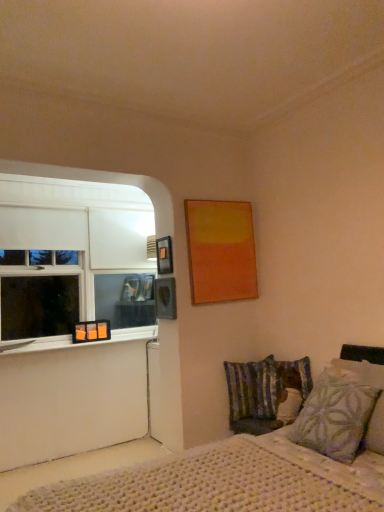
Question: Is patterned fabric pillow at lower right, marked as the first pillow in a right-to-left arrangement, at the back of clear glass window sill at lower left?

Choices:
 (A) no
 (B) yes

Answer: (A)

Question: From the image's perspective, is clear glass window sill at lower left under patterned fabric pillow at lower right, marked as the first pillow in a right-to-left arrangement?

Choices:
 (A) no
 (B) yes

Answer: (B)

Question: Does clear glass window sill at lower left have a greater height compared to patterned fabric pillow at lower right, marked as the first pillow in a right-to-left arrangement?

Choices:
 (A) yes
 (B) no

Answer: (B)

Question: Can we say clear glass window sill at lower left lies outside patterned fabric pillow at lower right, marked as the 2th pillow in a back-to-front arrangement?

Choices:
 (A) yes
 (B) no

Answer: (A)

Question: Can you confirm if clear glass window sill at lower left is bigger than patterned fabric pillow at lower right, the 2th pillow positioned from the left?

Choices:
 (A) no
 (B) yes

Answer: (A)

Question: Is clear glass window sill at lower left oriented towards patterned fabric pillow at lower right, the 2th pillow positioned from the left?

Choices:
 (A) no
 (B) yes

Answer: (A)

Question: Is matte black picture frame at upper left, the second picture frame viewed from the left, shorter than clear glass window sill at lower left?

Choices:
 (A) yes
 (B) no

Answer: (B)

Question: From the image's perspective, is matte black picture frame at upper left, the second picture frame positioned from the right, over clear glass window sill at lower left?

Choices:
 (A) no
 (B) yes

Answer: (B)

Question: Is there a large distance between matte black picture frame at upper left, the second picture frame viewed from the top, and clear glass window sill at lower left?

Choices:
 (A) yes
 (B) no

Answer: (A)

Question: From the image's perspective, would you say matte black picture frame at upper left, the second picture frame positioned from the right, is shown under clear glass window sill at lower left?

Choices:
 (A) no
 (B) yes

Answer: (A)

Question: Can you confirm if matte black picture frame at upper left, acting as the 2th picture frame starting from the front, is wider than clear glass window sill at lower left?

Choices:
 (A) yes
 (B) no

Answer: (B)

Question: Is matte black picture frame at upper left, the second picture frame positioned from the right, next to clear glass window sill at lower left and touching it?

Choices:
 (A) yes
 (B) no

Answer: (B)

Question: From a real-world perspective, does white knitted bed at lower right sit lower than white matte window at left?

Choices:
 (A) no
 (B) yes

Answer: (B)